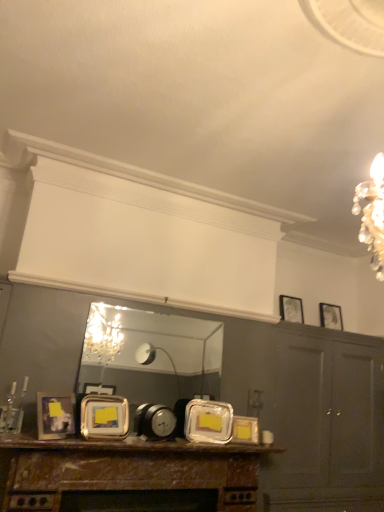
Question: Is matte silver picture frame at upper right, which ranks as the 5th picture frame in front-to-back order, at the back of rustic wood mantel at lower center?

Choices:
 (A) yes
 (B) no

Answer: (B)

Question: Can you confirm if rustic wood mantel at lower center is smaller than matte silver picture frame at upper right, the fifth picture frame when ordered from left to right?

Choices:
 (A) no
 (B) yes

Answer: (A)

Question: Can you confirm if rustic wood mantel at lower center is positioned to the right of matte silver picture frame at upper right, the first picture frame in the back-to-front sequence?

Choices:
 (A) no
 (B) yes

Answer: (A)

Question: Considering the relative sizes of rustic wood mantel at lower center and matte silver picture frame at upper right, marked as the 1th picture frame in a right-to-left arrangement, in the image provided, is rustic wood mantel at lower center wider than matte silver picture frame at upper right, marked as the 1th picture frame in a right-to-left arrangement,?

Choices:
 (A) no
 (B) yes

Answer: (B)

Question: Is rustic wood mantel at lower center oriented towards matte silver picture frame at upper right, the first picture frame in the back-to-front sequence?

Choices:
 (A) no
 (B) yes

Answer: (A)

Question: Relative to metallic silver alarm clock at center, is metallic silver frame at center, which appears as the fourth picture frame when viewed from the back, in front or behind?

Choices:
 (A) behind
 (B) front

Answer: (B)

Question: Is metallic silver frame at center, acting as the second picture frame starting from the left, inside the boundaries of metallic silver alarm clock at center, or outside?

Choices:
 (A) inside
 (B) outside

Answer: (B)

Question: Looking at their shapes, would you say metallic silver frame at center, which appears as the fourth picture frame when viewed from the back, is wider or thinner than metallic silver alarm clock at center?

Choices:
 (A) wide
 (B) thin

Answer: (B)

Question: Is metallic silver frame at center, which is the fourth picture frame in right-to-left order, taller or shorter than metallic silver alarm clock at center?

Choices:
 (A) tall
 (B) short

Answer: (A)

Question: Would you say metallic silver picture frame at upper right, the second picture frame in the right-to-left sequence, is to the left or to the right of metallic silver alarm clock at center in the picture?

Choices:
 (A) left
 (B) right

Answer: (B)

Question: From the image's perspective, relative to metallic silver alarm clock at center, is metallic silver picture frame at upper right, which is the fourth picture frame in left-to-right order, above or below?

Choices:
 (A) above
 (B) below

Answer: (A)

Question: In terms of height, does metallic silver picture frame at upper right, the second picture frame in the right-to-left sequence, look taller or shorter compared to metallic silver alarm clock at center?

Choices:
 (A) short
 (B) tall

Answer: (B)

Question: Is point (294, 296) closer or farther from the camera than point (137, 428)?

Choices:
 (A) farther
 (B) closer

Answer: (A)

Question: From a real-world perspective, relative to metallic silver frame at center, acting as the 2th picture frame starting from the front, is metallic silver alarm clock at center vertically above or below?

Choices:
 (A) below
 (B) above

Answer: (A)

Question: Considering the positions of point (140, 421) and point (89, 420), is point (140, 421) closer or farther from the camera than point (89, 420)?

Choices:
 (A) closer
 (B) farther

Answer: (B)